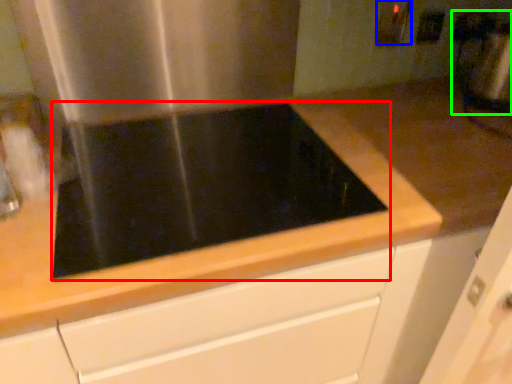
Question: Based on their relative distances, which object is farther from gas stove (highlighted by a red box)? Choose from electric outlet (highlighted by a blue box) and blender (highlighted by a green box).

Choices:
 (A) electric outlet
 (B) blender

Answer: (B)